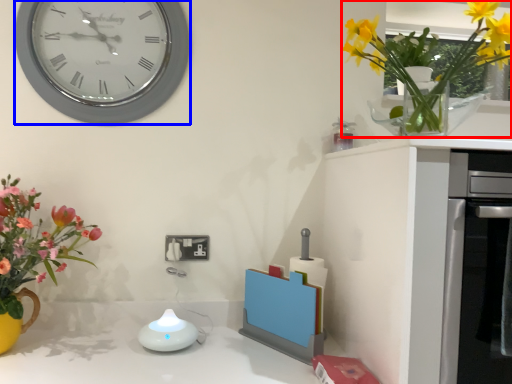
Question: Which object is further to the camera taking this photo, floral arrangement (highlighted by a red box) or wall clock (highlighted by a blue box)?

Choices:
 (A) floral arrangement
 (B) wall clock

Answer: (B)